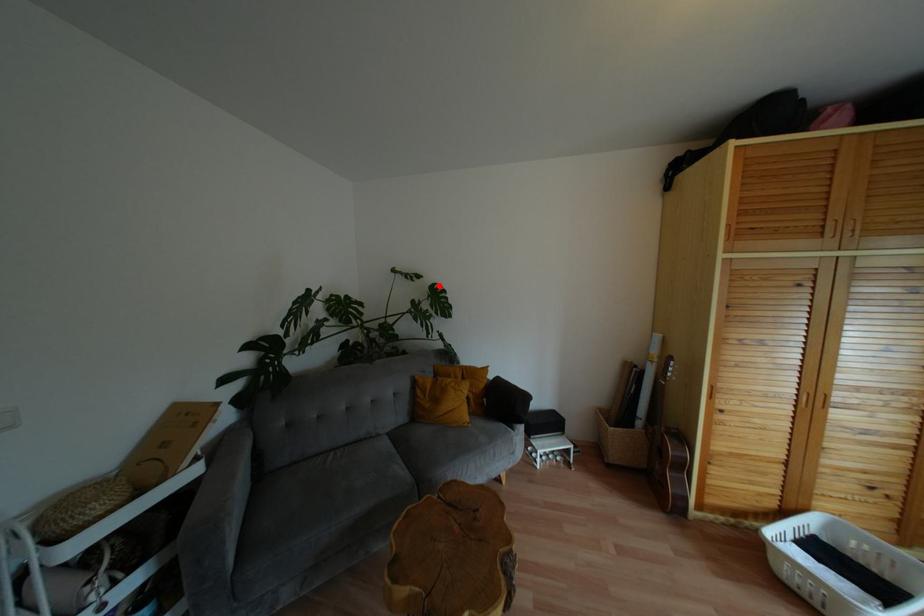
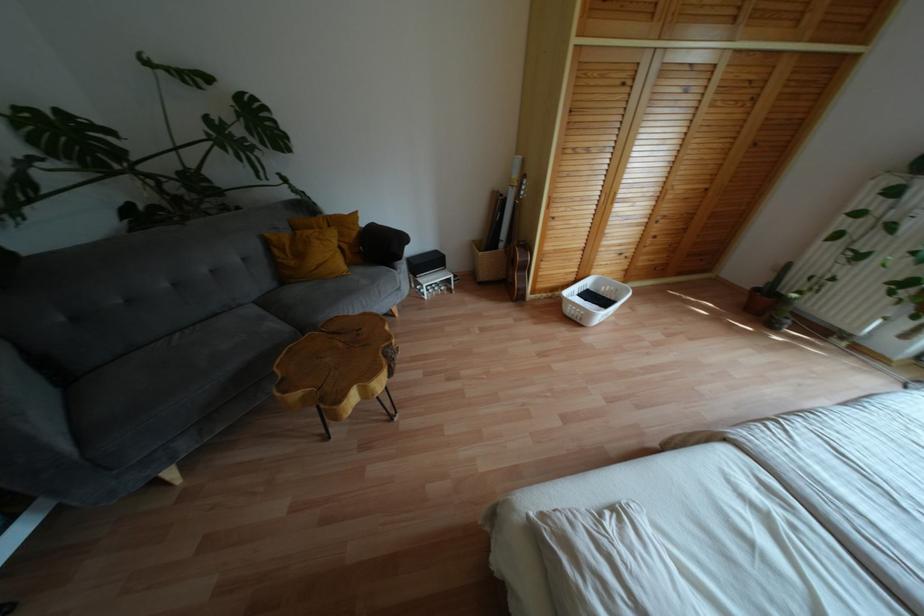
The point at the highlighted location is marked in the first image. Where is the corresponding point in the second image?

(253, 98)